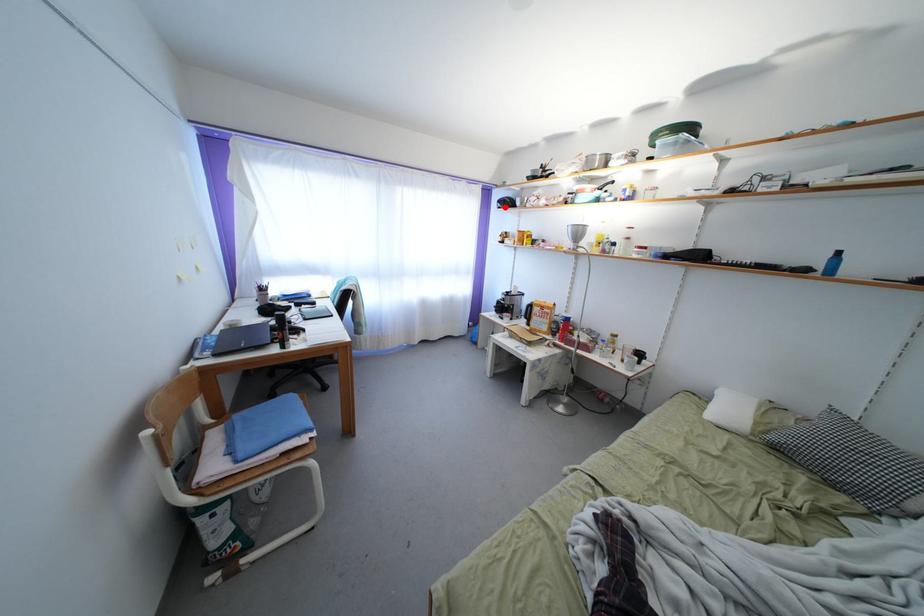
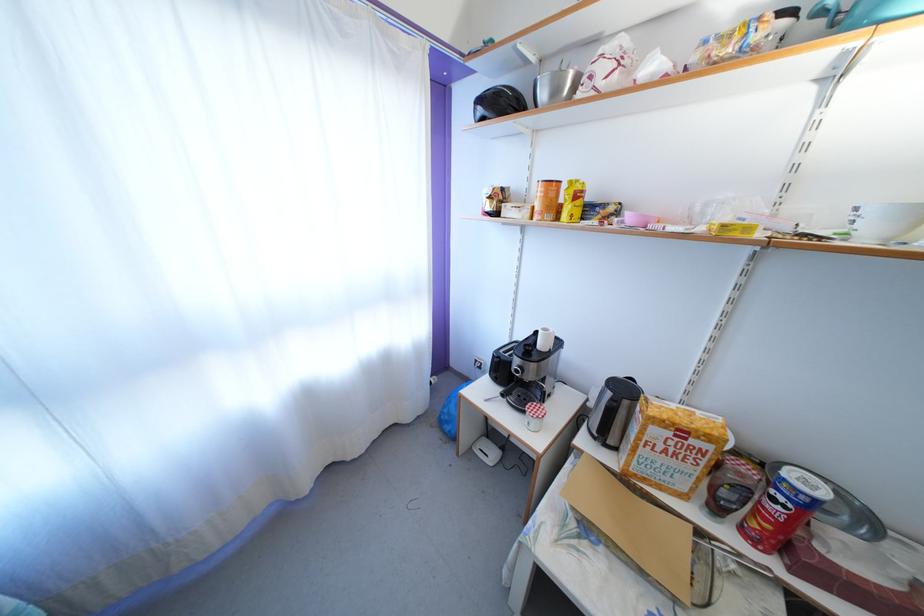
Locate, in the second image, the point that corresponds to the highlighted location in the first image.

(484, 107)